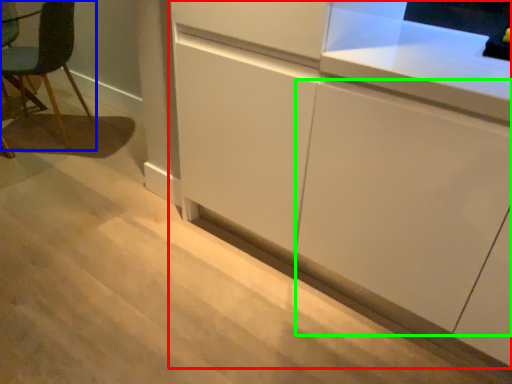
Question: Which is nearer to the cabinetry (highlighted by a red box)? chair (highlighted by a blue box) or cabinetry (highlighted by a green box).

Choices:
 (A) chair
 (B) cabinetry

Answer: (B)